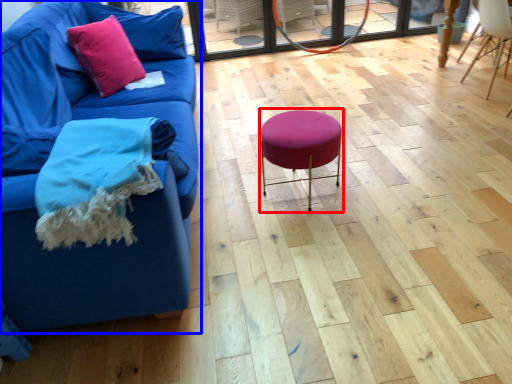
Question: Which point is further to the camera, bar stool (highlighted by a red box) or studio couch (highlighted by a blue box)?

Choices:
 (A) bar stool
 (B) studio couch

Answer: (A)